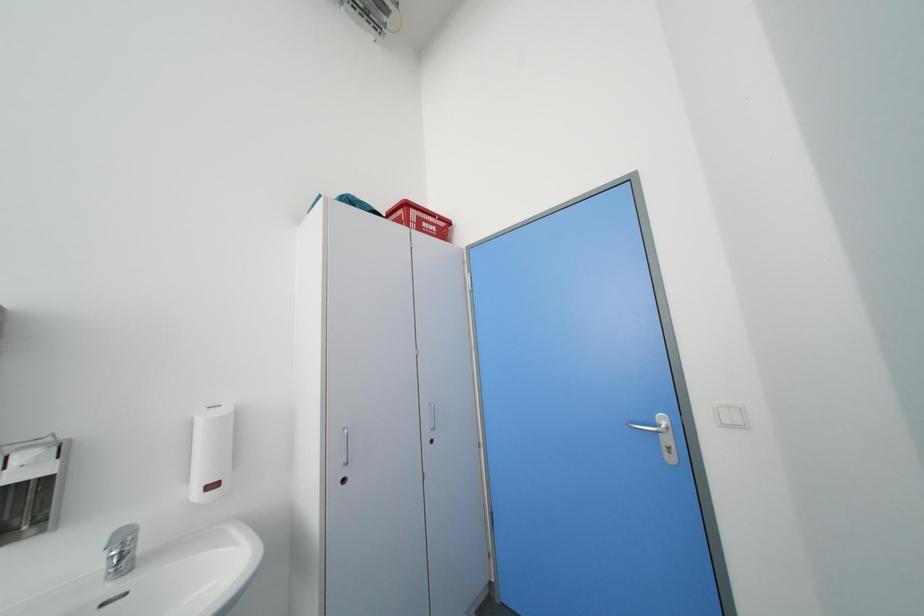
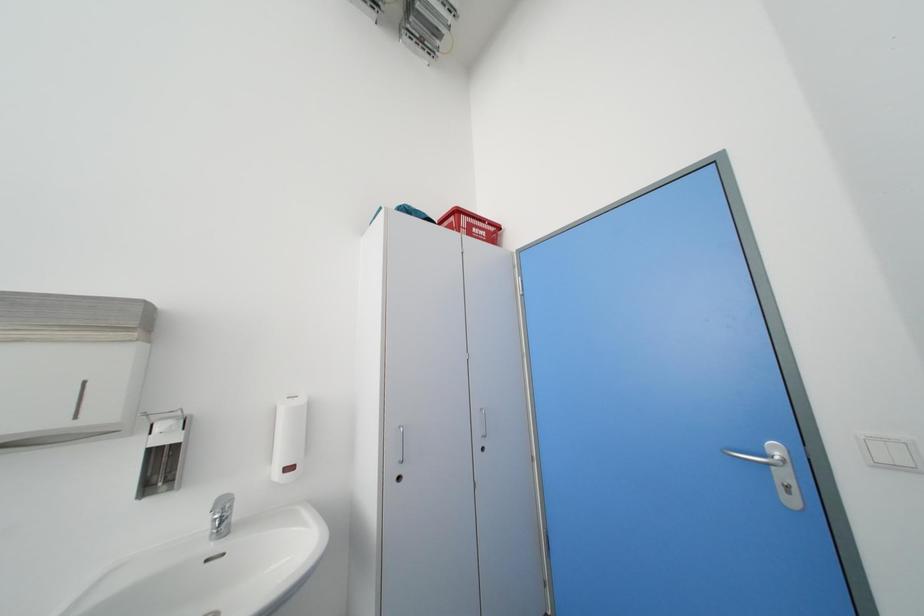
What movement of the cameraman would produce the second image?

The cameraman walked toward left, forward.